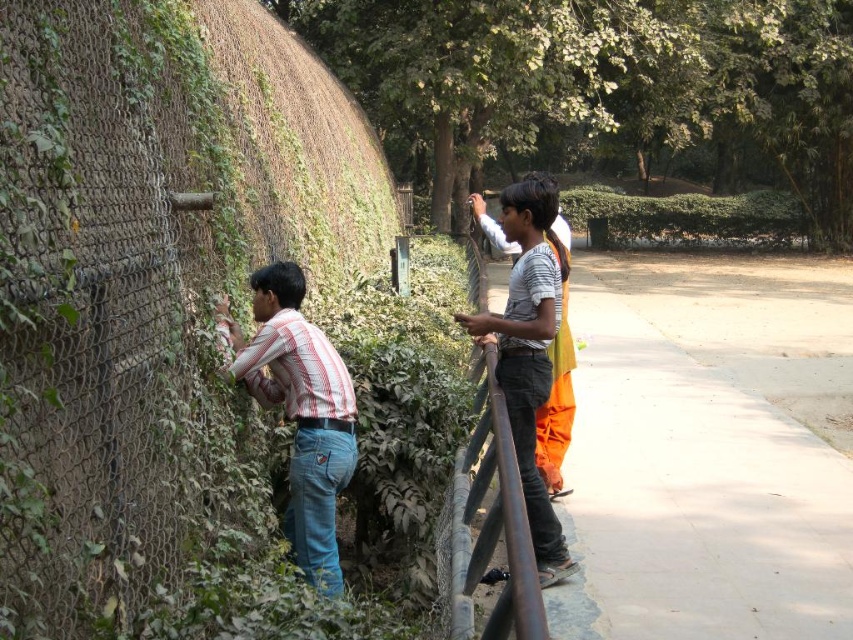
Is striped cotton shirt at left shorter than rusty metal rail at center?

No, striped cotton shirt at left is not shorter than rusty metal rail at center.

Is point (294, 486) farther from viewer compared to point (476, 285)?

No, it is not.

This screenshot has width=853, height=640. Identify the location of striped cotton shirt at left. (300, 412).

The width and height of the screenshot is (853, 640). Identify the location of striped cotton shirt at left. (300, 412).